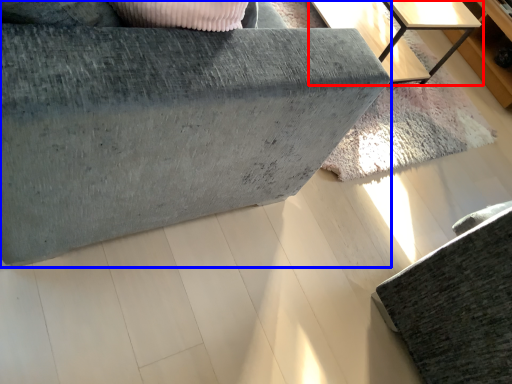
Question: Which object appears closest to the camera in this image, table (highlighted by a red box) or furniture (highlighted by a blue box)?

Choices:
 (A) table
 (B) furniture

Answer: (B)